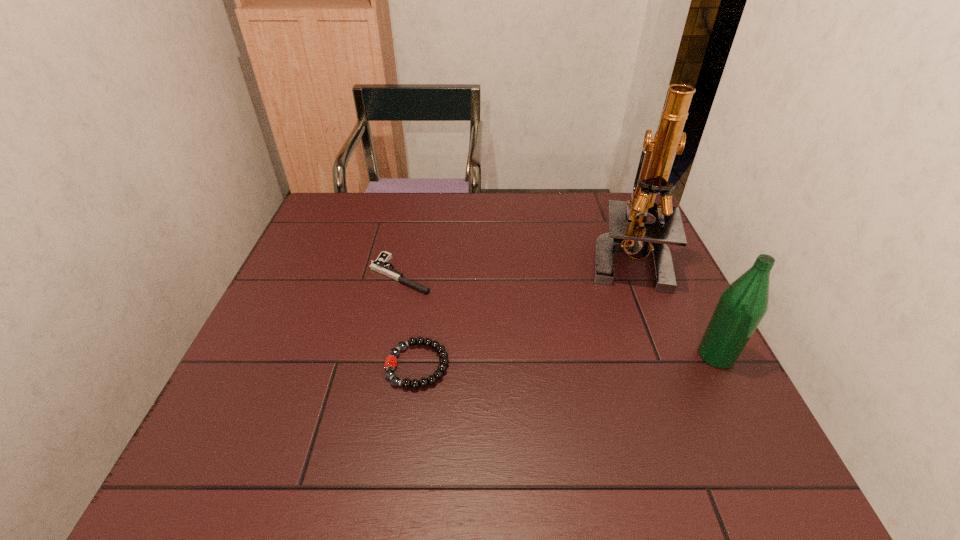
At what (x,y) coordinates should I click in order to perform the action: click on bracelet. Please return your answer as a coordinate pair (x, y). This screenshot has width=960, height=540. Looking at the image, I should click on (406, 383).

This screenshot has height=540, width=960. I want to click on bottle, so click(x=742, y=305).

Find the location of `microscope`. microscope is located at coordinates (628, 231).

Locate an element on the screen. Image resolution: width=960 pixels, height=540 pixels. pistol is located at coordinates (381, 264).

Find the location of a particular element. The height and width of the screenshot is (540, 960). vacant point located 0.080m on the front of the bracelet is located at coordinates (409, 428).

Locate an element on the screen. free region located on the left of the bottle is located at coordinates (603, 355).

You are a GUI agent. You are given a task and a screenshot of the screen. Output one action in this format:
    pyautogui.click(x=<x>, y=<y>)
    Task: Click on the free region located 0.090m at the eyepiece of the tallest object
    
    Given the screenshot: What is the action you would take?
    pyautogui.click(x=598, y=307)

At what (x,y) coordinates should I click in order to perform the action: click on vacant space located at the eyepiece of the tallest object. Please return your answer as a coordinate pair (x, y). Looking at the image, I should click on (600, 305).

Identify the location of blank area located 0.160m at the eyepiece of the tallest object. (586, 323).

I want to click on vacant area situated on the front-facing side of the shortest object, so click(455, 298).